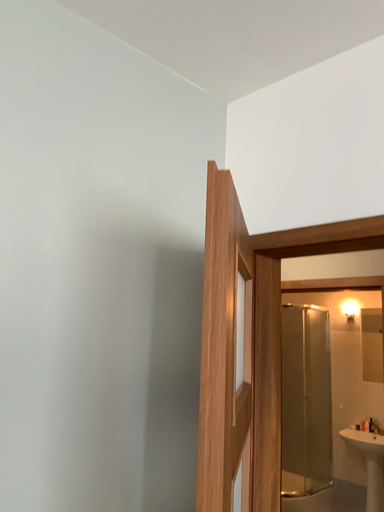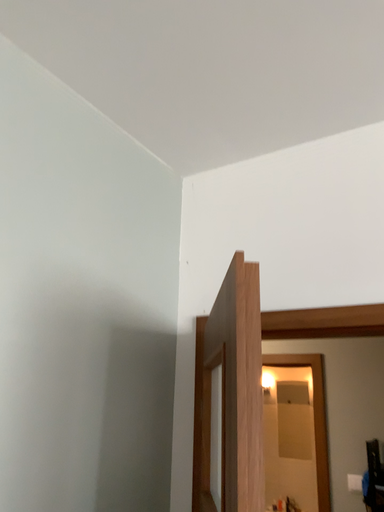
Question: Which way did the camera rotate in the video?

Choices:
 (A) rotated left
 (B) rotated right

Answer: (B)